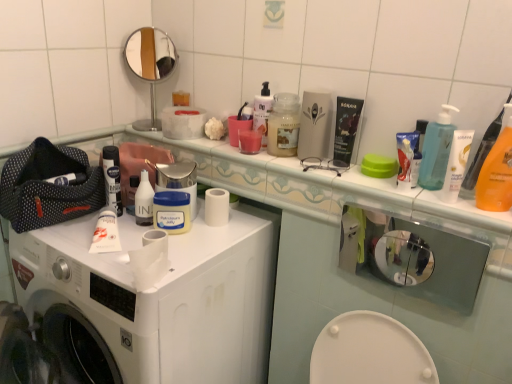
Question: Is white matte jar at center, which is counted as the second mouthwash, starting from the left, in contact with white glossy lotion at upper right, acting as the second toiletry starting from the left?

Choices:
 (A) yes
 (B) no

Answer: (B)

Question: Is white matte jar at center, the 3th mouthwash positioned from the right, to the right of white glossy lotion at upper right, acting as the first toiletry starting from the right, from the viewer's perspective?

Choices:
 (A) no
 (B) yes

Answer: (A)

Question: Considering the relative sizes of white matte jar at center, which is counted as the second mouthwash, starting from the left, and white glossy lotion at upper right, acting as the second toiletry starting from the back, in the image provided, is white matte jar at center, which is counted as the second mouthwash, starting from the left, shorter than white glossy lotion at upper right, acting as the second toiletry starting from the back,?

Choices:
 (A) no
 (B) yes

Answer: (B)

Question: From the image's perspective, would you say white matte jar at center, the 3th mouthwash positioned from the right, is positioned over white glossy lotion at upper right, acting as the second toiletry starting from the back?

Choices:
 (A) no
 (B) yes

Answer: (A)

Question: From a real-world perspective, is white matte jar at center, which is counted as the second mouthwash, starting from the left, positioned under white glossy lotion at upper right, acting as the second toiletry starting from the left, based on gravity?

Choices:
 (A) yes
 (B) no

Answer: (A)

Question: Is white matte jar at center, the 3th mouthwash positioned from the right, completely or partially outside of white glossy lotion at upper right, acting as the second toiletry starting from the back?

Choices:
 (A) no
 (B) yes

Answer: (B)

Question: Considering the relative positions of white matte toilet paper at center and translucent plastic pump bottle at upper right in the image provided, is white matte toilet paper at center in front of translucent plastic pump bottle at upper right?

Choices:
 (A) yes
 (B) no

Answer: (A)

Question: Can you confirm if white matte toilet paper at center is bigger than translucent plastic pump bottle at upper right?

Choices:
 (A) yes
 (B) no

Answer: (A)

Question: Is white matte toilet paper at center to the right of translucent plastic pump bottle at upper right from the viewer's perspective?

Choices:
 (A) yes
 (B) no

Answer: (B)

Question: Considering the relative sizes of white matte toilet paper at center and translucent plastic pump bottle at upper right in the image provided, is white matte toilet paper at center thinner than translucent plastic pump bottle at upper right?

Choices:
 (A) no
 (B) yes

Answer: (A)

Question: Does white matte toilet paper at center lie behind translucent plastic pump bottle at upper right?

Choices:
 (A) no
 (B) yes

Answer: (A)

Question: Is white matte toilet paper at center wider than translucent plastic pump bottle at upper right?

Choices:
 (A) no
 (B) yes

Answer: (B)

Question: From the image's perspective, is white matte washing machine at center over metallic silver glasses at upper center?

Choices:
 (A) no
 (B) yes

Answer: (A)